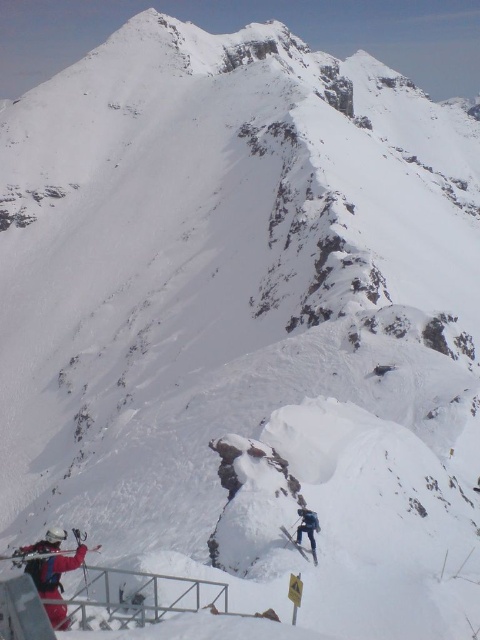
You are planning to take a photo of both the red fabric jacket at lower left and the dark blue ski suit at center. Since you want both subjects to be clearly visible in the frame, will you need to adjust your camera focus to ensure both are in focus?

The red fabric jacket at lower left is in front of the dark blue ski suit at center, so you will need to adjust your camera focus to ensure both are in focus as they are at different distances from the camera.

Looking at this image, you are a hiker planning to take a photo of the snowy mountain landscape. You want to include both the red fabric jacket at lower left and the metal railing in your shot. Based on their positions, which object is closer to the center of the image?

The red fabric jacket at lower left is located at point (51, 561), which is closer to the center of the image compared to the metal railing, so the red fabric jacket at lower left is closer to the center.

You are planning to take a photo of both the red fabric jacket at lower left and the dark blue ski suit at center from a position where both are visible. Given that your camera has a maximum focal length that allows capturing objects up to 10 meters apart in the same frame, will you be able to include both in a single photo?

The red fabric jacket at lower left is 8.91 meters from the dark blue ski suit at center. Since the distance between them is within the camera maximum focal length of 10 meters, you can include both in a single photo.